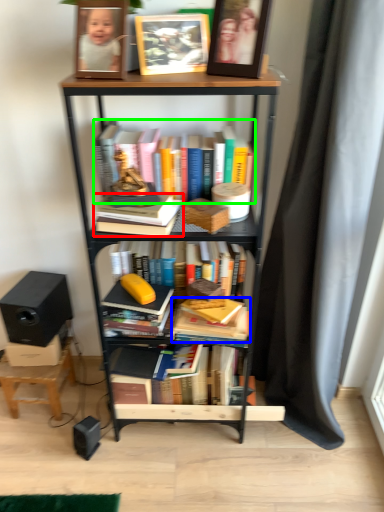
Question: Which object is positioned closest to book (highlighted by a red box)? Select from book (highlighted by a blue box) and book (highlighted by a green box).

Choices:
 (A) book
 (B) book

Answer: (B)